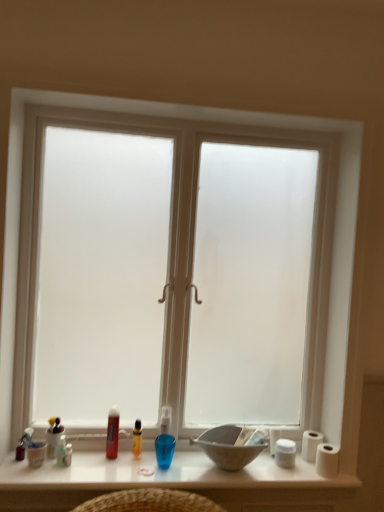
Where is `vacant space that's between translucent plastic bottle at lower left, which is counted as the 3th toiletry, starting from the left, and white matte toilet paper at right, placed as the second toilet paper when sorted from back to front`? This screenshot has width=384, height=512. vacant space that's between translucent plastic bottle at lower left, which is counted as the 3th toiletry, starting from the left, and white matte toilet paper at right, placed as the second toilet paper when sorted from back to front is located at coordinates (198, 471).